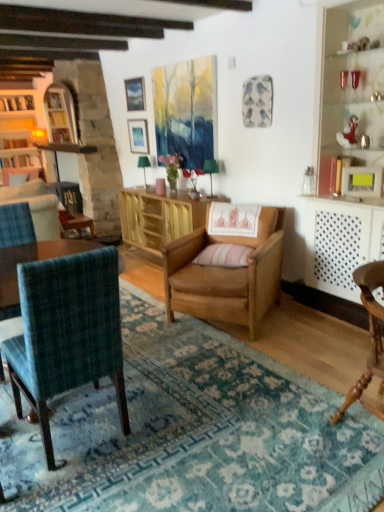
Question: Can you confirm if wooden chair at lower right, which is counted as the first chair, starting from the right, is thinner than wooden cabinet at center?

Choices:
 (A) no
 (B) yes

Answer: (B)

Question: Considering the relative positions of wooden chair at lower right, marked as the third chair in a left-to-right arrangement, and wooden cabinet at center in the image provided, is wooden chair at lower right, marked as the third chair in a left-to-right arrangement, behind wooden cabinet at center?

Choices:
 (A) no
 (B) yes

Answer: (A)

Question: Is wooden chair at lower right, which is counted as the first chair, starting from the right, with wooden cabinet at center?

Choices:
 (A) no
 (B) yes

Answer: (A)

Question: Considering the relative sizes of wooden chair at lower right, marked as the third chair in a left-to-right arrangement, and wooden cabinet at center in the image provided, is wooden chair at lower right, marked as the third chair in a left-to-right arrangement, smaller than wooden cabinet at center?

Choices:
 (A) no
 (B) yes

Answer: (B)

Question: Does wooden chair at lower right, marked as the third chair in a left-to-right arrangement, appear on the right side of wooden cabinet at center?

Choices:
 (A) yes
 (B) no

Answer: (A)

Question: From a real-world perspective, does wooden chair at lower right, marked as the third chair in a left-to-right arrangement, sit lower than wooden cabinet at center?

Choices:
 (A) yes
 (B) no

Answer: (A)

Question: From a real-world perspective, is pink striped pillow at center under light brown wood chair at center, acting as the second chair starting from the left?

Choices:
 (A) no
 (B) yes

Answer: (A)

Question: From a real-world perspective, is pink striped pillow at center physically above light brown wood chair at center, acting as the second chair starting from the left?

Choices:
 (A) yes
 (B) no

Answer: (A)

Question: Considering the relative sizes of pink striped pillow at center and light brown wood chair at center, acting as the second chair starting from the left, in the image provided, is pink striped pillow at center wider than light brown wood chair at center, acting as the second chair starting from the left,?

Choices:
 (A) yes
 (B) no

Answer: (B)

Question: Does pink striped pillow at center have a larger size compared to light brown wood chair at center, which ranks as the 2th chair in right-to-left order?

Choices:
 (A) no
 (B) yes

Answer: (A)

Question: Is the surface of pink striped pillow at center in direct contact with light brown wood chair at center, acting as the second chair starting from the left?

Choices:
 (A) no
 (B) yes

Answer: (A)

Question: Considering the relative positions of pink striped pillow at center and light brown wood chair at center, acting as the second chair starting from the left, in the image provided, is pink striped pillow at center to the left of light brown wood chair at center, acting as the second chair starting from the left, from the viewer's perspective?

Choices:
 (A) yes
 (B) no

Answer: (A)

Question: Is wooden chair at lower right, marked as the third chair in a left-to-right arrangement, not inside matte silver picture frame at upper center, the third picture frame when ordered from front to back?

Choices:
 (A) no
 (B) yes

Answer: (B)